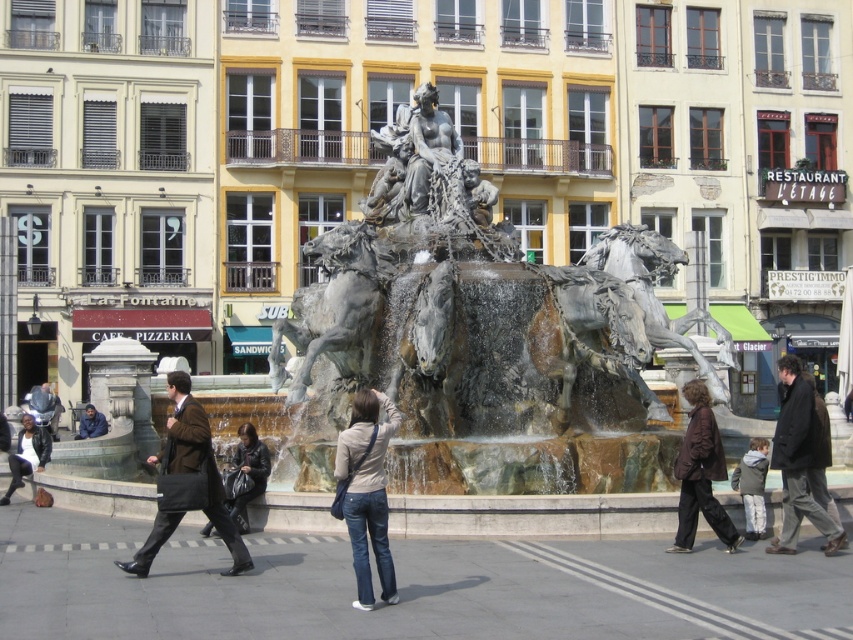
Based on the photo, you are standing in the urban square and want to take a photo of both the fountain and a nearby building. You notice two points marked in the scene. Which point, point (x=358, y=541) or point (x=3, y=504), is closer to you and would allow you to capture both the fountain and the building in the same frame?

Point (x=358, y=541) is closer to the viewer than point (x=3, y=504), so choosing that position would help you capture both the fountain and the nearby building in the same frame.